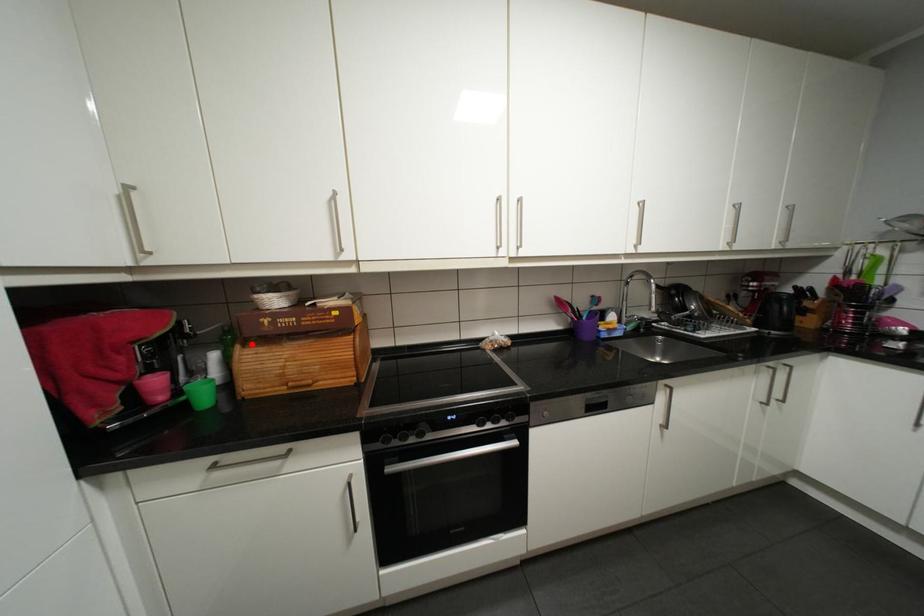
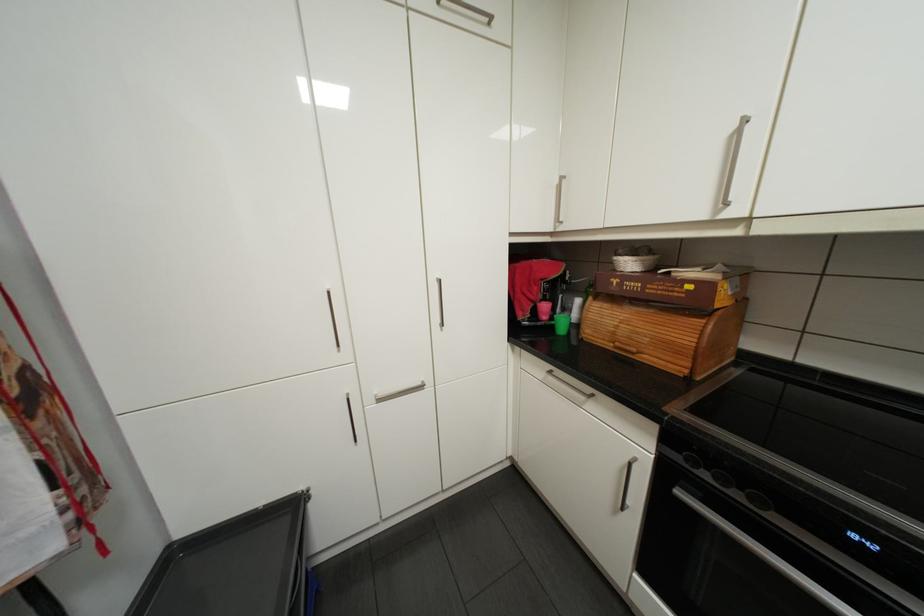
Find the pixel in the second image that matches the highlighted location in the first image.

(602, 297)